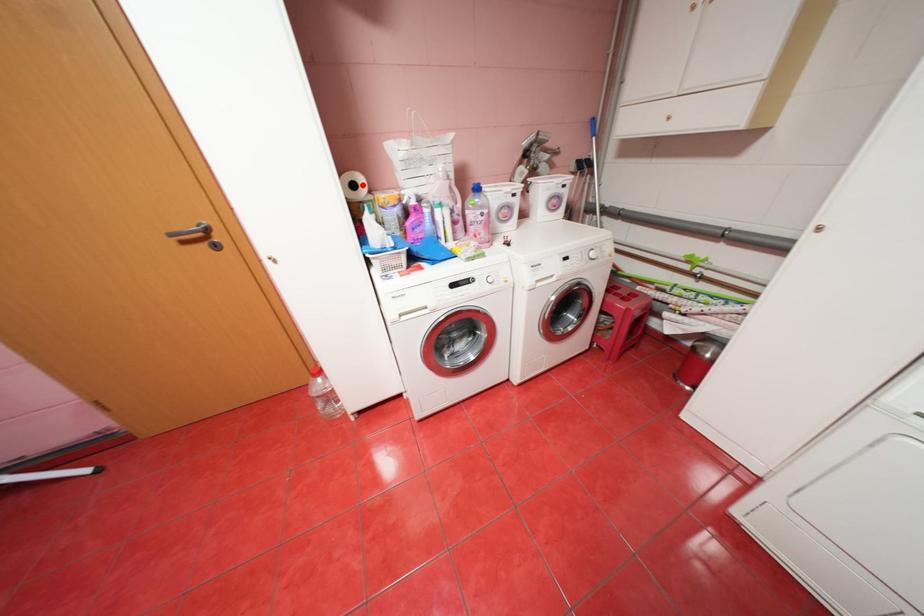
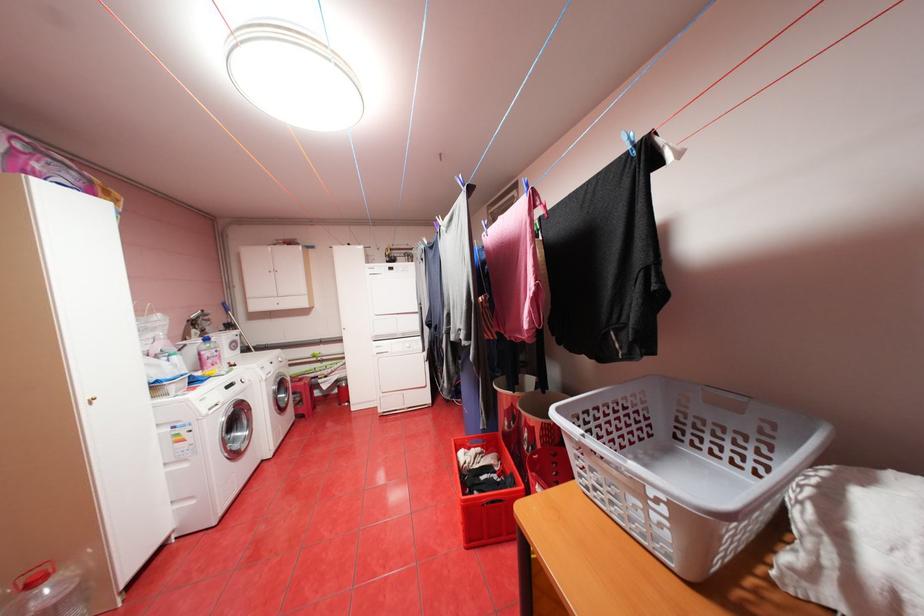
Question: I am providing you with two images of the same scene from different viewpoints. A red point is marked on the first image. At the location where the point appears in image 1, is it still visible in image 2?

Choices:
 (A) Yes
 (B) No

Answer: (B)